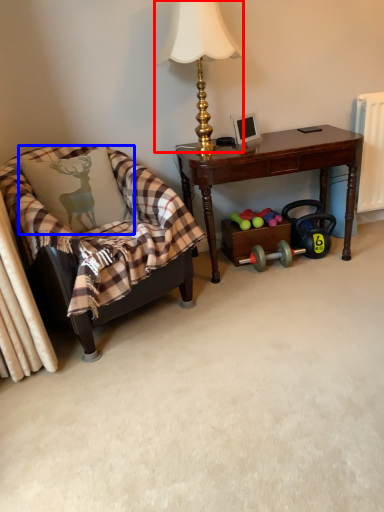
Question: Which of the following is the closest to the observer, lamp (highlighted by a red box) or pillow (highlighted by a blue box)?

Choices:
 (A) lamp
 (B) pillow

Answer: (A)